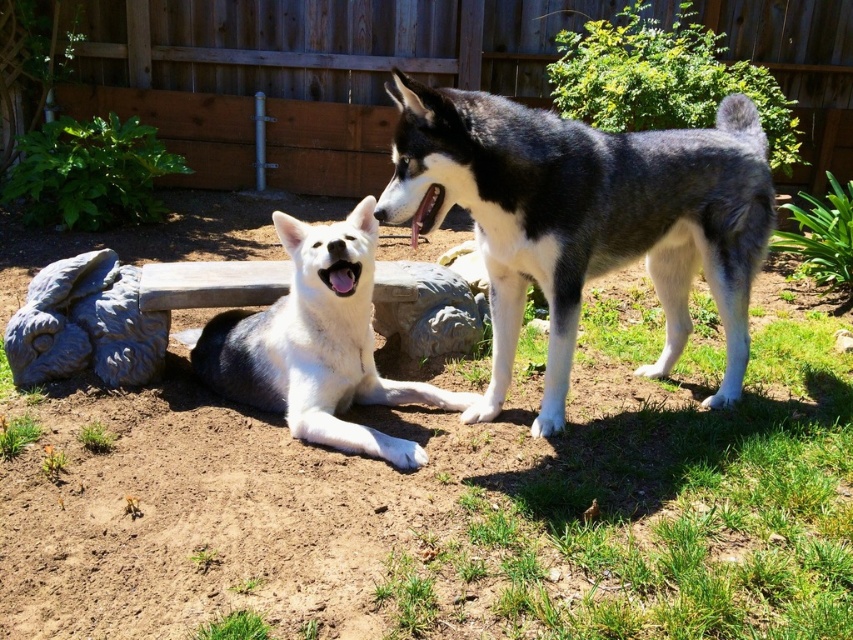
Can you confirm if white fur dog at center is thinner than gray stone statue at lower left?

Incorrect, white fur dog at center's width is not less than gray stone statue at lower left's.

Is white fur dog at center to the right of gray stone statue at lower left from the viewer's perspective?

Indeed, white fur dog at center is positioned on the right side of gray stone statue at lower left.

The image size is (853, 640). What do you see at coordinates (316, 342) in the screenshot?
I see `white fur dog at center` at bounding box center [316, 342].

Identify the location of white fur dog at center. coord(316,342).

Can you confirm if gray-black fur husky at center is shorter than white fur dog at center?

Incorrect, gray-black fur husky at center's height does not fall short of white fur dog at center's.

Who is more forward, [746,186] or [223,336]?

Point [746,186]

At what (x,y) coordinates should I click in order to perform the action: click on gray-black fur husky at center. Please return your answer as a coordinate pair (x, y). Looking at the image, I should click on (585, 218).

Between gray-black fur husky at center and gray stone statue at lower left, which one appears on the right side from the viewer's perspective?

gray-black fur husky at center

Can you confirm if gray-black fur husky at center is positioned to the right of gray stone statue at lower left?

Indeed, gray-black fur husky at center is positioned on the right side of gray stone statue at lower left.

Where is `gray-black fur husky at center`? This screenshot has height=640, width=853. gray-black fur husky at center is located at coordinates (585, 218).

Identify the location of gray-black fur husky at center. The height and width of the screenshot is (640, 853). (585, 218).